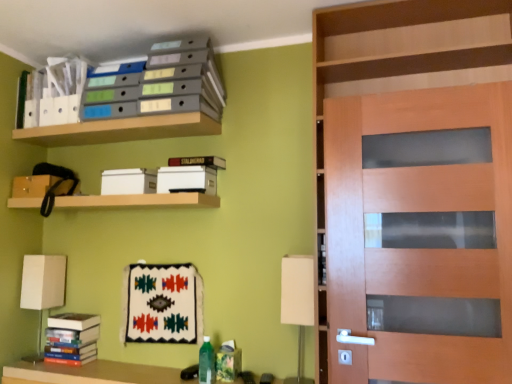
Question: Considering their positions, is white fabric lampshade at lower right, placed as the 2th table lamp when sorted from left to right, located in front of or behind wooden door at right?

Choices:
 (A) behind
 (B) front

Answer: (A)

Question: From a real-world perspective, is white fabric lampshade at lower right, which appears as the 1th table lamp when viewed from the front, positioned above or below wooden door at right?

Choices:
 (A) above
 (B) below

Answer: (B)

Question: Estimate the real-world distances between objects in this image. Which object is farther from the hardcover book at upper center, the second book ordered from the bottom?

Choices:
 (A) wooden door at right
 (B) wooden shelf at upper center, which is counted as the first shelf, starting from the bottom
 (C) matte plastic file folders at upper center, the 3th shelf in the bottom-to-top sequence
 (D) wooden shelf at upper center, the second shelf positioned from the bottom
 (E) white fabric lampshade at lower right, the 2th table lamp positioned from the back

Answer: (A)

Question: Considering the real-world distances, which object is farthest from the white fabric table lamp at lower left, which appears as the first table lamp when viewed from the back?

Choices:
 (A) hardcover book at upper center, the second book from the left
 (B) white fabric lampshade at lower right, the 2th table lamp positioned from the back
 (C) wooden door at right
 (D) matte plastic file folders at upper center, the 3th shelf in the bottom-to-top sequence
 (E) hardcover books at lower left, marked as the 1th book in a left-to-right arrangement

Answer: (C)